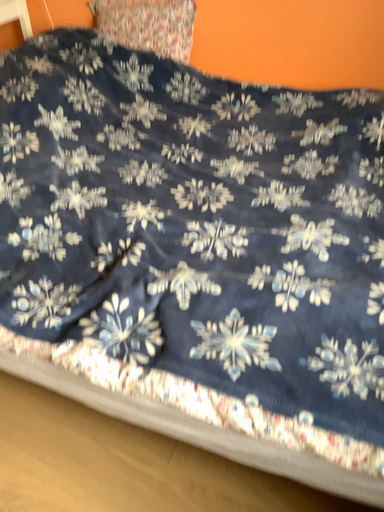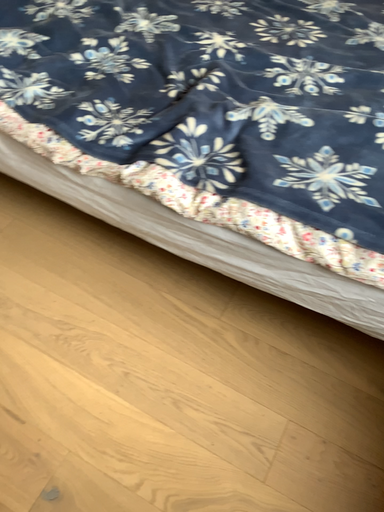
Question: How did the camera likely rotate when shooting the video?

Choices:
 (A) rotated upward
 (B) rotated downward

Answer: (B)